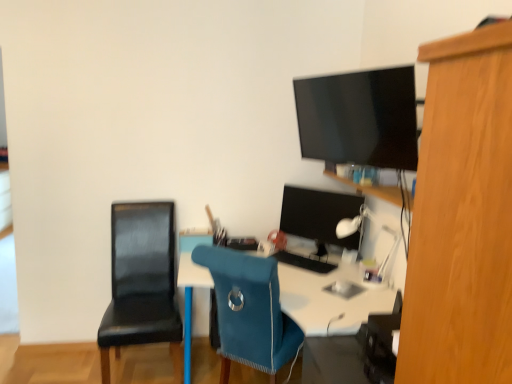
I want to click on free space to the left of white plastic lamp at upper right, so click(316, 284).